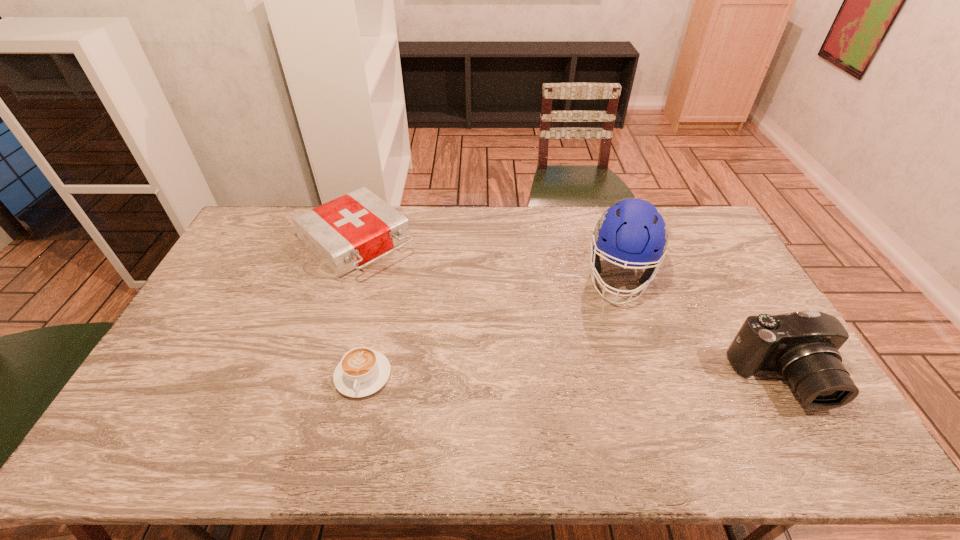
Find the location of a particular element. This screenshot has height=540, width=960. cappuccino is located at coordinates (362, 371).

At what (x,y) coordinates should I click in order to perform the action: click on the second tallest object. Please return your answer as a coordinate pair (x, y). Looking at the image, I should click on (802, 346).

Locate an element on the screen. The width and height of the screenshot is (960, 540). camera is located at coordinates (802, 346).

Where is `the second object from right to left`? the second object from right to left is located at coordinates (632, 232).

Identify the location of football helmet. (632, 232).

Locate an element on the screen. The image size is (960, 540). the second shortest object is located at coordinates (347, 232).

Where is `free location located 0.330m on the face guard of the tallest object`? Image resolution: width=960 pixels, height=540 pixels. free location located 0.330m on the face guard of the tallest object is located at coordinates (603, 397).

Find the location of a particular element. free spot located 0.260m on the face guard of the tallest object is located at coordinates (607, 376).

I want to click on vacant region located on the face guard of the tallest object, so click(612, 342).

The height and width of the screenshot is (540, 960). What are the coordinates of `vacant region located 0.380m on the front side of the third tallest object` in the screenshot? It's located at (467, 337).